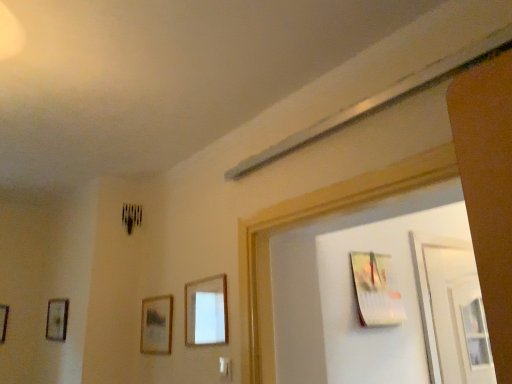
Question: From a real-world perspective, is wooden picture frame at left, the fifth picture frame viewed from the right, located beneath wooden picture frame at left, which is counted as the fourth picture frame, starting from the right?

Choices:
 (A) no
 (B) yes

Answer: (B)

Question: Is wooden picture frame at left, the 2th picture frame positioned from the left, a part of wooden picture frame at left, the fifth picture frame viewed from the right?

Choices:
 (A) no
 (B) yes

Answer: (A)

Question: Does wooden picture frame at left, which ranks as the 1th picture frame in left-to-right order, have a lesser height compared to wooden picture frame at left, which is counted as the fourth picture frame, starting from the right?

Choices:
 (A) no
 (B) yes

Answer: (B)

Question: From a real-world perspective, is wooden picture frame at left, which ranks as the 1th picture frame in left-to-right order, on wooden picture frame at left, the 2th picture frame positioned from the left?

Choices:
 (A) no
 (B) yes

Answer: (A)

Question: Does wooden picture frame at left, which ranks as the 1th picture frame in left-to-right order, have a greater height compared to wooden picture frame at left, which is counted as the fourth picture frame, starting from the right?

Choices:
 (A) yes
 (B) no

Answer: (B)

Question: Considering the relative positions of wooden picture frame at left, the fifth picture frame viewed from the right, and wooden picture frame at left, which is counted as the fourth picture frame, starting from the right, in the image provided, is wooden picture frame at left, the fifth picture frame viewed from the right, behind wooden picture frame at left, which is counted as the fourth picture frame, starting from the right,?

Choices:
 (A) no
 (B) yes

Answer: (B)

Question: Could you tell me if wooden picture frame at left, the 2th picture frame positioned from the left, is turned towards wooden picture frame at left, which ranks as the 1th picture frame in left-to-right order?

Choices:
 (A) no
 (B) yes

Answer: (A)

Question: Is wooden picture frame at left, the 2th picture frame positioned from the left, closer to the viewer compared to wooden picture frame at left, the fifth picture frame viewed from the right?

Choices:
 (A) no
 (B) yes

Answer: (B)

Question: Is wooden picture frame at left, the 2th picture frame positioned from the left, shorter than wooden picture frame at left, which ranks as the 1th picture frame in left-to-right order?

Choices:
 (A) no
 (B) yes

Answer: (A)

Question: Is wooden picture frame at left, which is counted as the fourth picture frame, starting from the right, surrounding wooden picture frame at left, which ranks as the 1th picture frame in left-to-right order?

Choices:
 (A) no
 (B) yes

Answer: (A)

Question: From a real-world perspective, is wooden picture frame at left, the 2th picture frame positioned from the left, physically above wooden picture frame at left, the fifth picture frame viewed from the right?

Choices:
 (A) no
 (B) yes

Answer: (B)

Question: Does wooden picture frame at left, the 2th picture frame positioned from the left, have a greater width compared to wooden picture frame at left, the fifth picture frame viewed from the right?

Choices:
 (A) yes
 (B) no

Answer: (A)

Question: Is metallic silver picture frame at upper right, the 5th picture frame when ordered from left to right, bigger than wooden picture frame at left, the fifth picture frame viewed from the right?

Choices:
 (A) no
 (B) yes

Answer: (B)